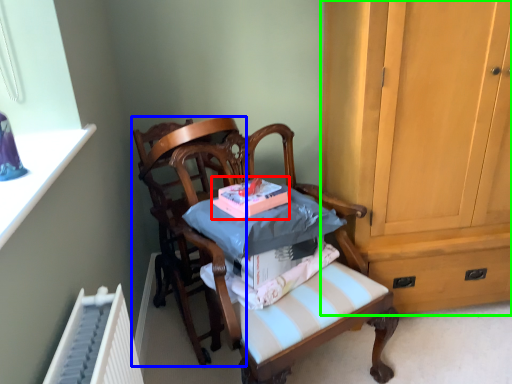
Question: Which is nearer to the book (highlighted by a red box)? chair (highlighted by a blue box) or cabinetry (highlighted by a green box).

Choices:
 (A) chair
 (B) cabinetry

Answer: (A)